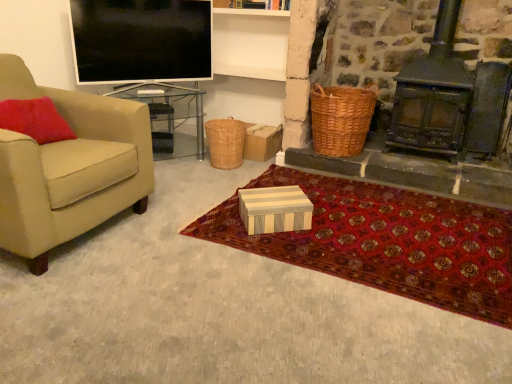
Question: Does flat screen tv at upper left have a greater width compared to red carpet at center?

Choices:
 (A) no
 (B) yes

Answer: (A)

Question: From a real-world perspective, is flat screen tv at upper left positioned under red carpet at center based on gravity?

Choices:
 (A) no
 (B) yes

Answer: (A)

Question: Is flat screen tv at upper left next to red carpet at center?

Choices:
 (A) yes
 (B) no

Answer: (B)

Question: Can you confirm if flat screen tv at upper left is thinner than red carpet at center?

Choices:
 (A) no
 (B) yes

Answer: (B)

Question: Can you confirm if flat screen tv at upper left is bigger than red carpet at center?

Choices:
 (A) no
 (B) yes

Answer: (A)

Question: Considering the positions of point (182, 137) and point (172, 132), is point (182, 137) closer or farther from the camera than point (172, 132)?

Choices:
 (A) closer
 (B) farther

Answer: (B)

Question: Based on their sizes in the image, would you say transparent glass table at left is bigger or smaller than white striped cardboard box at center, the first box in the left-to-right sequence?

Choices:
 (A) small
 (B) big

Answer: (B)

Question: From a real-world perspective, is transparent glass table at left above or below white striped cardboard box at center, the first box in the left-to-right sequence?

Choices:
 (A) above
 (B) below

Answer: (A)

Question: Is transparent glass table at left in front of or behind white striped cardboard box at center, the 2th box from the front, in the image?

Choices:
 (A) front
 (B) behind

Answer: (A)

Question: Relative to white striped cardboard box at center, which ranks as the second box in right-to-left order, is woven brown picnic basket at center, the 2th picnic basket positioned from the right, in front or behind?

Choices:
 (A) behind
 (B) front

Answer: (B)

Question: Is point (218, 160) closer or farther from the camera than point (157, 132)?

Choices:
 (A) farther
 (B) closer

Answer: (A)

Question: From their relative heights in the image, would you say woven brown picnic basket at center, the 2th picnic basket positioned from the right, is taller or shorter than white striped cardboard box at center, the first box viewed from the top?

Choices:
 (A) short
 (B) tall

Answer: (B)

Question: From the image's perspective, is woven brown picnic basket at center, the 2th picnic basket positioned from the right, located above or below white striped cardboard box at center, the first box in the left-to-right sequence?

Choices:
 (A) above
 (B) below

Answer: (A)

Question: From a real-world perspective, is white striped cardboard box at center, the first box viewed from the top, positioned above or below woven brown picnic basket at right, which ranks as the first picnic basket in right-to-left order?

Choices:
 (A) above
 (B) below

Answer: (B)

Question: Looking at the image, does white striped cardboard box at center, the 1th box from the back, seem bigger or smaller compared to woven brown picnic basket at right, which ranks as the first picnic basket in right-to-left order?

Choices:
 (A) small
 (B) big

Answer: (A)